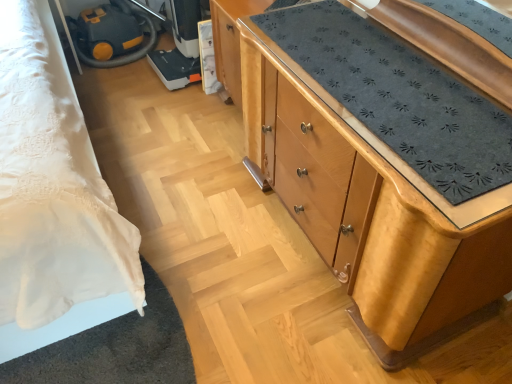
Describe the element at coordinates (366, 207) in the screenshot. I see `wooden chest of drawers at center` at that location.

Measure the distance between wooden chest of drawers at center and camera.

33.92 inches.

What is the approximate width of wooden chest of drawers at center?

wooden chest of drawers at center is 20.21 inches wide.

Where is `wooden chest of drawers at center`? This screenshot has height=384, width=512. wooden chest of drawers at center is located at coordinates (366, 207).

This screenshot has height=384, width=512. Find the location of `wooden chest of drawers at center`. wooden chest of drawers at center is located at coordinates (366, 207).